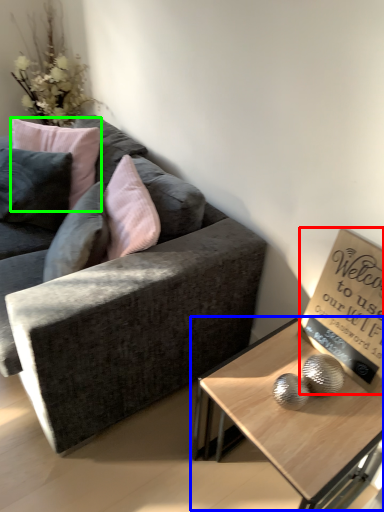
Question: Which is nearer to the bulletin board (highlighted by a red box)? coffee table (highlighted by a blue box) or pillow (highlighted by a green box).

Choices:
 (A) coffee table
 (B) pillow

Answer: (A)